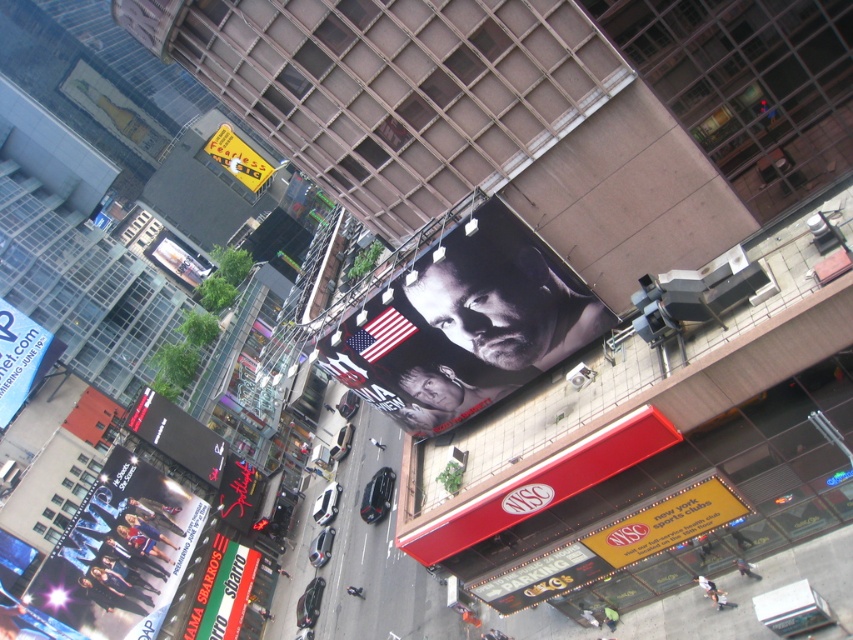
Question: Which object is the farthest from the black matte sign at center?

Choices:
 (A) yellow fabric sign at center
 (B) yellow plastic sign at upper left
 (C) green fabric sign at lower left

Answer: (B)

Question: Which point appears farthest from the camera in this image?

Choices:
 (A) (21, 317)
 (B) (218, 500)
 (C) (518, 589)
 (D) (213, 588)

Answer: (B)

Question: Is yellow fabric sign at center below blue plastic billboard at upper left?

Choices:
 (A) yes
 (B) no

Answer: (A)

Question: Does metallic silver billboard at lower left lie behind blue plastic billboard at upper left?

Choices:
 (A) yes
 (B) no

Answer: (B)

Question: From the image, what is the correct spatial relationship of metallic silver billboard at lower left in relation to yellow fabric sign at center?

Choices:
 (A) above
 (B) below

Answer: (B)

Question: Among these objects, which one is farthest from the camera?

Choices:
 (A) black matte sign at center
 (B) metallic silver sign at lower center
 (C) green fabric sign at lower left
 (D) blue plastic billboard at upper left

Answer: (A)